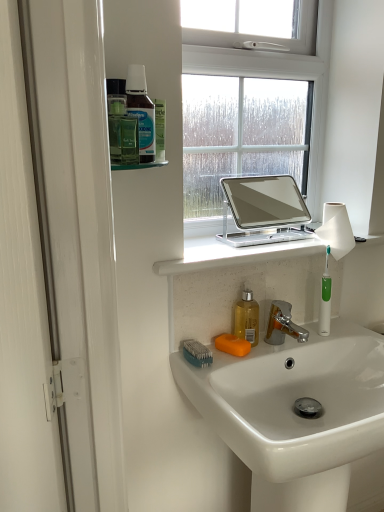
This screenshot has height=512, width=384. In order to click on blank space situated above white stone window sill at center (from a real-world perspective) in this screenshot , I will do `click(253, 239)`.